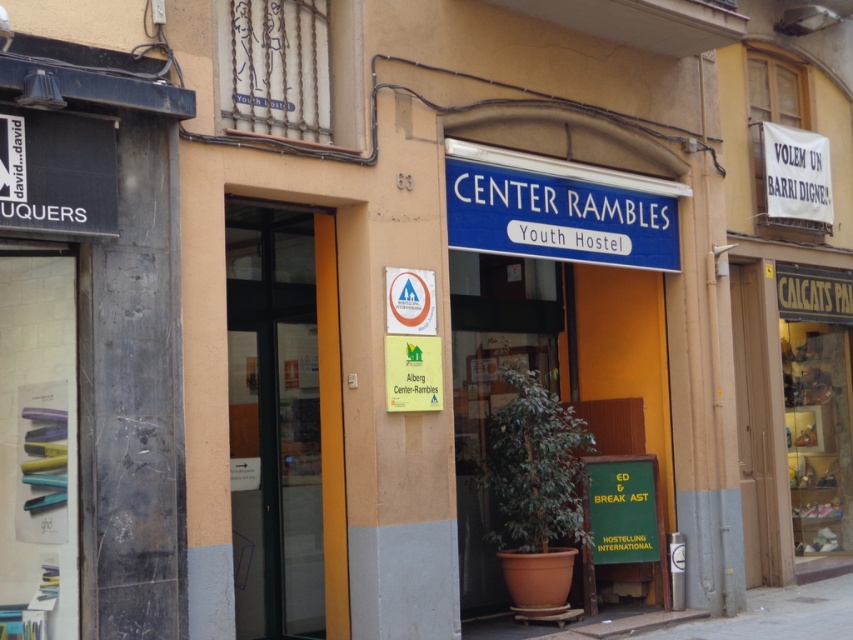
Question: From the image, what is the correct spatial relationship of transparent glass door at center in relation to blue plastic sign at center?

Choices:
 (A) right
 (B) left

Answer: (B)

Question: Which object is the farthest from the transparent glass door at center?

Choices:
 (A) green matte signboard at lower right
 (B) blue plastic sign at center
 (C) gray concrete pavement at lower center

Answer: (C)

Question: Which point is closer to the camera taking this photo?

Choices:
 (A) (723, 624)
 (B) (314, 621)

Answer: (B)

Question: Does blue plastic sign at center have a larger size compared to gray concrete pavement at lower center?

Choices:
 (A) yes
 (B) no

Answer: (B)

Question: Which of the following is the farthest from the observer?

Choices:
 (A) (323, 461)
 (B) (753, 600)
 (C) (634, 484)
 (D) (476, 248)

Answer: (B)

Question: Does green matte signboard at lower right appear on the right side of gray concrete pavement at lower center?

Choices:
 (A) no
 (B) yes

Answer: (A)